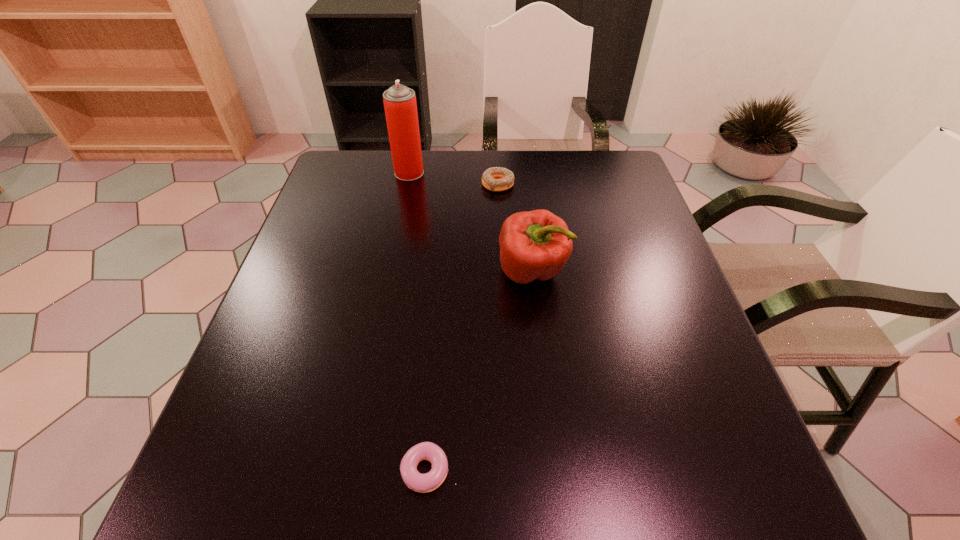
This screenshot has width=960, height=540. In the image, there is a desktop. Identify the location of vacant space at the far right corner. (597, 180).

The width and height of the screenshot is (960, 540). I want to click on blank region between the leftmost object and the shorter doughnut, so click(x=420, y=321).

Locate an element on the screen. vacant space in between the taller doughnut and the tallest object is located at coordinates click(453, 178).

At what (x,y) coordinates should I click in order to perform the action: click on free space between the left doughnut and the right doughnut. Please return your answer as a coordinate pair (x, y). Looking at the image, I should click on (464, 327).

Identify the location of vacant point located between the nearer doughnut and the tallest object. This screenshot has height=540, width=960. (420, 321).

The height and width of the screenshot is (540, 960). In order to click on vacant area that lies between the third shortest object and the leftmost object in this screenshot , I will do `click(470, 222)`.

Find the location of a particular element. free spot between the left doughnut and the third farthest object is located at coordinates (481, 371).

The height and width of the screenshot is (540, 960). What are the coordinates of `free space that is in between the second nearest object and the nearer doughnut` in the screenshot? It's located at (481, 371).

At what (x,y) coordinates should I click in order to perform the action: click on vacant space in between the bell pepper and the nearest object. Please return your answer as a coordinate pair (x, y). The image size is (960, 540). Looking at the image, I should click on (481, 371).

Locate an element on the screen. The width and height of the screenshot is (960, 540). free spot between the farther doughnut and the third object from right to left is located at coordinates (464, 327).